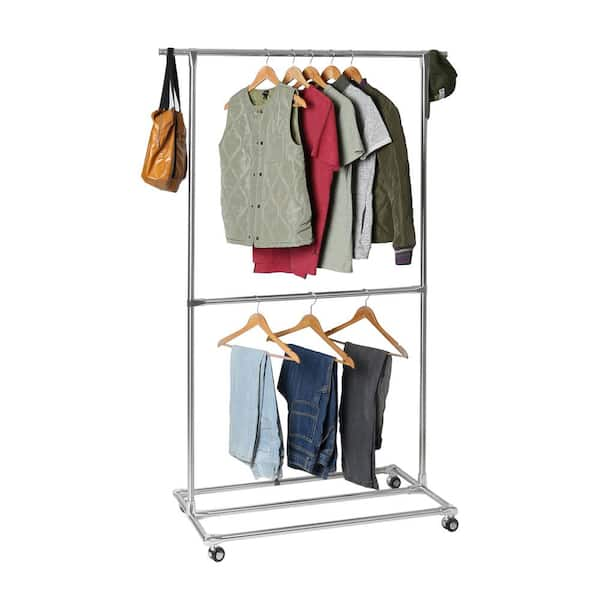
Where is `wood part of hangers`? wood part of hangers is located at coordinates (355, 70), (333, 70), (309, 73), (294, 73), (261, 73), (361, 310), (306, 319), (261, 322).